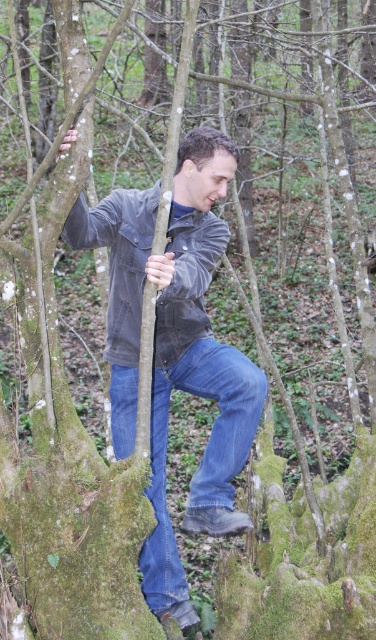
Can you confirm if denim jacket at center is shorter than washed denim jacket at center?

Incorrect, denim jacket at center's height does not fall short of washed denim jacket at center's.

Which is behind, point (212, 378) or point (121, 300)?

The point (121, 300) is behind.

Locate an element on the screen. denim jacket at center is located at coordinates (174, 348).

At what (x,y) coordinates should I click in order to perform the action: click on denim jacket at center. Please return your answer as a coordinate pair (x, y). The image size is (376, 640). Looking at the image, I should click on (174, 348).

Between point (250, 388) and point (186, 516), which one is positioned behind?

The point (186, 516) is more distant.

Can you confirm if denim jacket at center is shorter than blue denim jeans at center?

Incorrect, denim jacket at center's height does not fall short of blue denim jeans at center's.

Between point (183, 627) and point (174, 582), which one is positioned in front?

Positioned in front is point (183, 627).

Find the location of a particular element. denim jacket at center is located at coordinates (174, 348).

Which is behind, point (218, 464) or point (181, 248)?

Point (181, 248)

Consider the image. Can you confirm if blue denim jeans at center is positioned above washed denim jacket at center?

Incorrect, blue denim jeans at center is not positioned above washed denim jacket at center.

This screenshot has width=376, height=640. I want to click on blue denim jeans at center, so click(x=203, y=454).